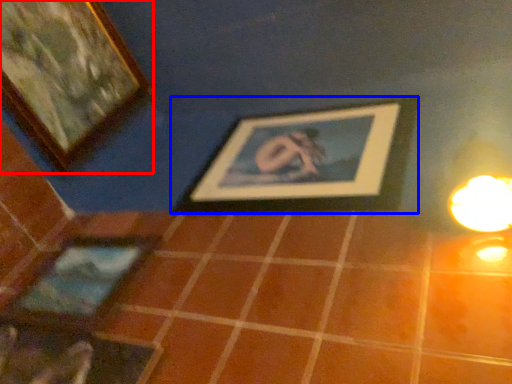
Question: Which object appears farthest to the camera in this image, picture frame (highlighted by a red box) or picture frame (highlighted by a blue box)?

Choices:
 (A) picture frame
 (B) picture frame

Answer: (A)